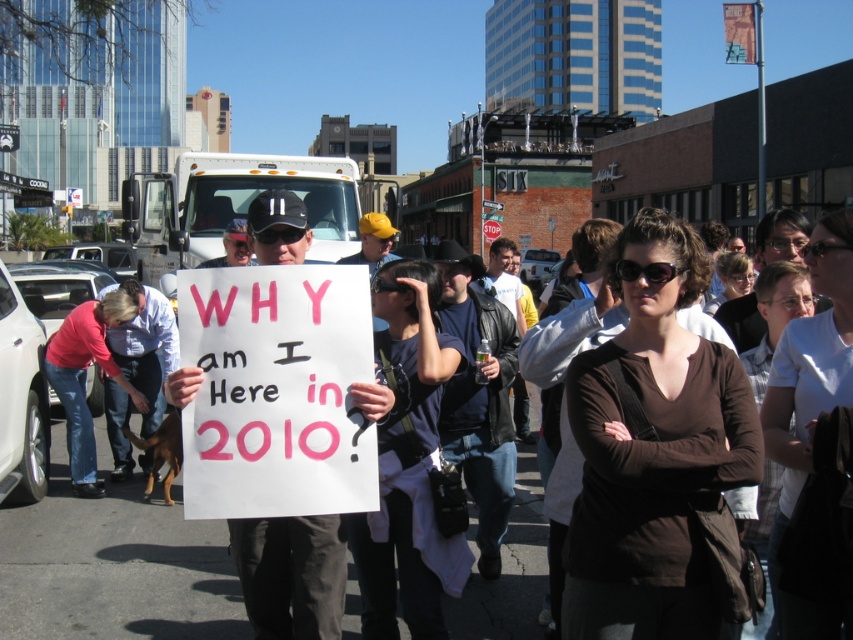
Does dark blue shirt at center appear on the left side of white cotton shirt at center?

Correct, you'll find dark blue shirt at center to the left of white cotton shirt at center.

Is dark blue shirt at center positioned at the back of white cotton shirt at center?

Yes.

Which is behind, point (392, 442) or point (769, 598)?

Positioned behind is point (392, 442).

Where is `dark blue shirt at center`? This screenshot has width=853, height=640. dark blue shirt at center is located at coordinates coord(407,464).

Between brown matte shirt at center and dark blue shirt at center, which one is positioned higher?

brown matte shirt at center is above.

Can you confirm if brown matte shirt at center is thinner than dark blue shirt at center?

No.

Describe the element at coordinates (653, 449) in the screenshot. I see `brown matte shirt at center` at that location.

Find the location of a particular element. The height and width of the screenshot is (640, 853). brown matte shirt at center is located at coordinates (653, 449).

Is brown matte shirt at center bigger than brown fabric shirt at center?

Correct, brown matte shirt at center is larger in size than brown fabric shirt at center.

Does brown matte shirt at center have a lesser width compared to brown fabric shirt at center?

No.

Between point (590, 444) and point (791, 340), which one is positioned in front?

Point (590, 444) is more forward.

This screenshot has width=853, height=640. I want to click on brown matte shirt at center, so click(653, 449).